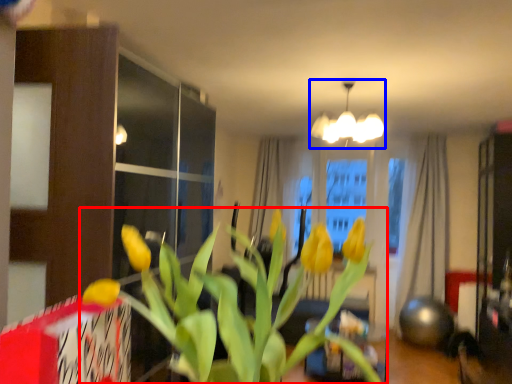
Question: Among these objects, which one is farthest to the camera, houseplant (highlighted by a red box) or lamp (highlighted by a blue box)?

Choices:
 (A) houseplant
 (B) lamp

Answer: (B)